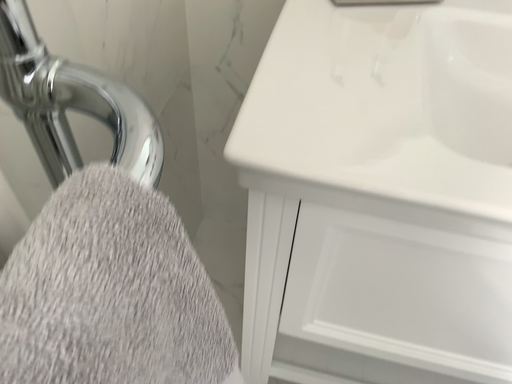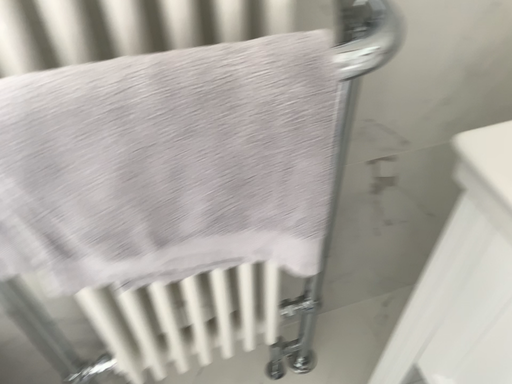
Question: How did the camera likely rotate when shooting the video?

Choices:
 (A) rotated left
 (B) rotated right

Answer: (A)